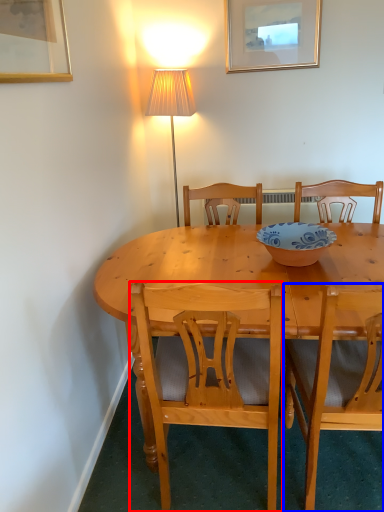
Question: Which of the following is the closest to the observer, chair (highlighted by a red box) or chair (highlighted by a blue box)?

Choices:
 (A) chair
 (B) chair

Answer: (B)